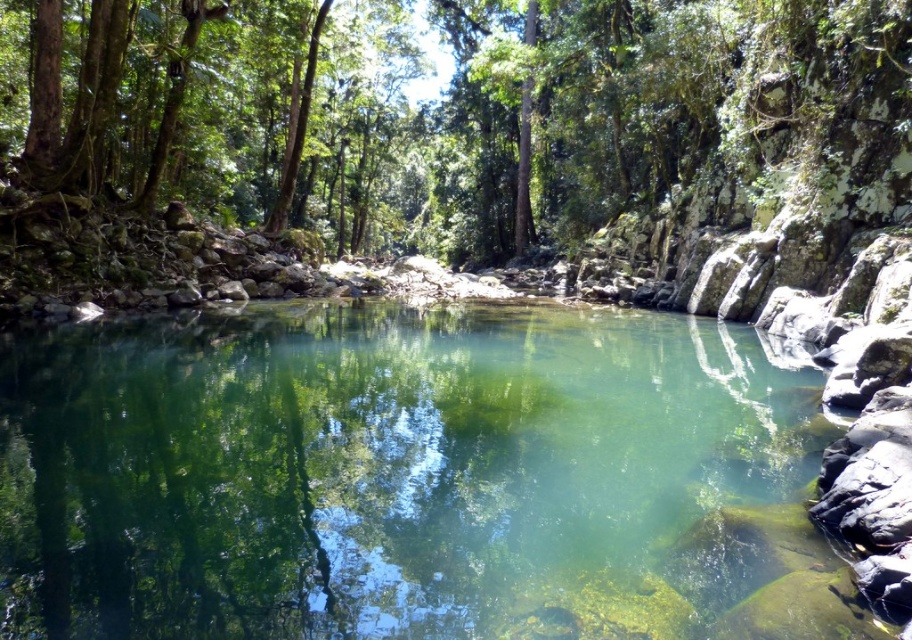
Between clear glassy water at center and green leafy tree at center, which one has more height?

Standing taller between the two is green leafy tree at center.

Who is positioned more to the right, clear glassy water at center or green leafy tree at center?

Positioned to the right is clear glassy water at center.

Which is in front, point (306, 579) or point (250, 202)?

Positioned in front is point (306, 579).

Where is `clear glassy water at center`? Image resolution: width=912 pixels, height=640 pixels. clear glassy water at center is located at coordinates (394, 474).